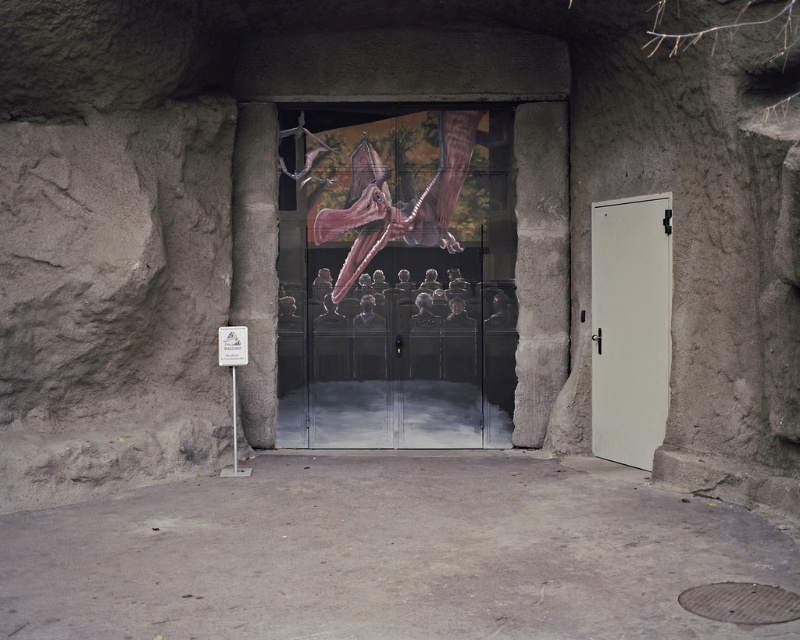
Is transparent glass doors at center above white matte door at right?

Yes.

Does transparent glass doors at center have a greater width compared to white matte door at right?

Correct, the width of transparent glass doors at center exceeds that of white matte door at right.

Who is more distant from viewer, (486, 364) or (632, 365)?

The point (486, 364) is more distant.

At what (x,y) coordinates should I click in order to perform the action: click on transparent glass doors at center. Please return your answer as a coordinate pair (x, y). The image size is (800, 640). Looking at the image, I should click on (396, 278).